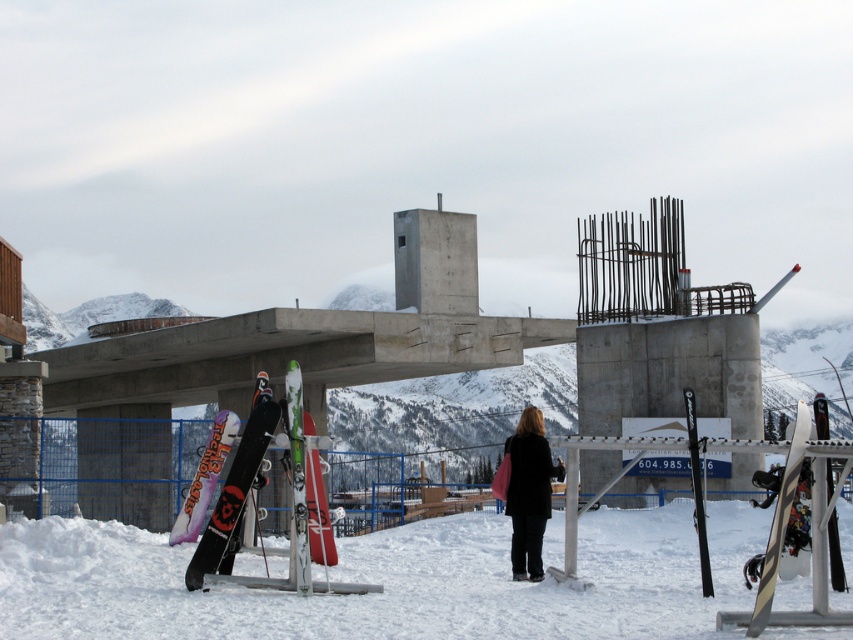
You are a delivery person who needs to place a package between the white snowboard at lower center and the black matte coat at center. The package requires 3 feet of space. Can you fit it there?

The white snowboard at lower center and black matte coat at center are 31.18 feet apart from each other, so yes, the package requiring 3 feet of space can be placed between them as there is sufficient space.

You are standing at the snowboard rack and want to place your black matte coat at center near your matte red snowboard at center. Given the distance between them is 7.74 meters, can you comfortably carry your coat while walking that distance without dropping it?

The black matte coat at center is 7.74 meters away from the matte red snowboard at center. Since the distance is over 7 meters, it might be challenging to carry the coat that far without dropping it, so you may want to place it closer.